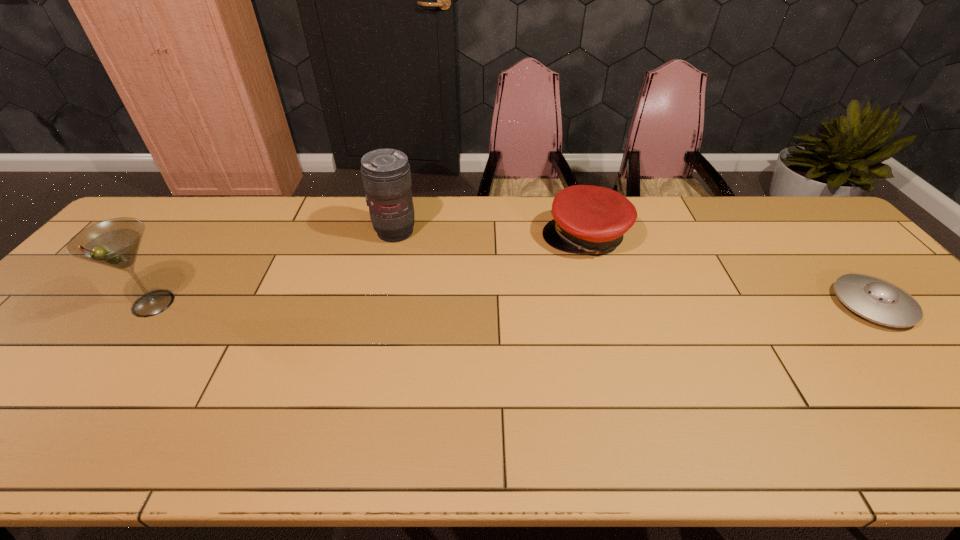
Point out which object is positioned as the third nearest to the third object from right to left. Please provide its 2D coordinates. Your answer should be formatted as a tuple, i.e. [(x, y)], where the tuple contains the x and y coordinates of a point satisfying the conditions above.

[(875, 299)]

The image size is (960, 540). In order to click on vacant space that satisfies the following two spatial constraints: 1. on the back side of the telephoto lens; 2. on the right side of the martini in this screenshot , I will do `click(206, 232)`.

The width and height of the screenshot is (960, 540). What are the coordinates of `free location that satisfies the following two spatial constraints: 1. on the back side of the martini; 2. on the right side of the third tallest object` in the screenshot? It's located at (203, 237).